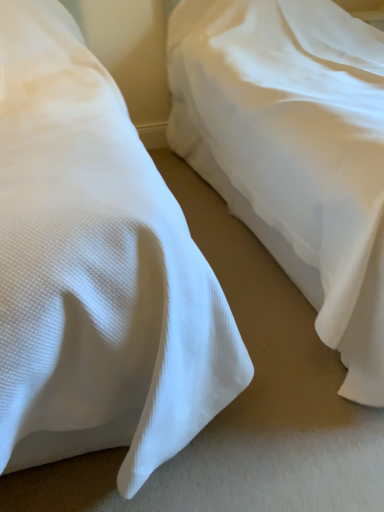
Where is `white textured pillow at left, which appears as the 1th bed when viewed from the left`? The width and height of the screenshot is (384, 512). white textured pillow at left, which appears as the 1th bed when viewed from the left is located at coordinates (96, 267).

Image resolution: width=384 pixels, height=512 pixels. Describe the element at coordinates (96, 267) in the screenshot. I see `white textured pillow at left, which appears as the 1th bed when viewed from the left` at that location.

I want to click on white textured fabric at center, placed as the 2th bed when sorted from left to right, so click(x=294, y=152).

The width and height of the screenshot is (384, 512). Describe the element at coordinates (294, 152) in the screenshot. I see `white textured fabric at center, placed as the 2th bed when sorted from left to right` at that location.

Where is `white textured pillow at left, which appears as the 1th bed when viewed from the left`? white textured pillow at left, which appears as the 1th bed when viewed from the left is located at coordinates (96, 267).

Can you confirm if white textured pillow at left, which appears as the 1th bed when viewed from the left, is positioned to the right of white textured fabric at center, the 1th bed from the right?

No, white textured pillow at left, which appears as the 1th bed when viewed from the left, is not to the right of white textured fabric at center, the 1th bed from the right.

In the scene shown: Is white textured pillow at left, the second bed viewed from the right, positioned in front of white textured fabric at center, the 1th bed from the right?

Yes, white textured pillow at left, the second bed viewed from the right, is in front of white textured fabric at center, the 1th bed from the right.

Does point (94, 449) lie behind point (356, 269)?

Yes, point (94, 449) is behind point (356, 269).

From the image's perspective, would you say white textured pillow at left, which appears as the 1th bed when viewed from the left, is shown under white textured fabric at center, placed as the 2th bed when sorted from left to right?

→ Indeed, from the image's perspective, white textured pillow at left, which appears as the 1th bed when viewed from the left, is shown beneath white textured fabric at center, placed as the 2th bed when sorted from left to right.

From a real-world perspective, is white textured pillow at left, which appears as the 1th bed when viewed from the left, on white textured fabric at center, placed as the 2th bed when sorted from left to right?

Yes, from a real-world perspective, white textured pillow at left, which appears as the 1th bed when viewed from the left, is over white textured fabric at center, placed as the 2th bed when sorted from left to right

Which object is thinner, white textured pillow at left, the second bed viewed from the right, or white textured fabric at center, placed as the 2th bed when sorted from left to right?

Thinner between the two is white textured fabric at center, placed as the 2th bed when sorted from left to right.

Which of these two, white textured pillow at left, the second bed viewed from the right, or white textured fabric at center, the 1th bed from the right, stands shorter?

white textured fabric at center, the 1th bed from the right, is shorter.

Consider the image. Which of these two, white textured pillow at left, which appears as the 1th bed when viewed from the left, or white textured fabric at center, placed as the 2th bed when sorted from left to right, is smaller?

With smaller size is white textured pillow at left, which appears as the 1th bed when viewed from the left.

Is white textured pillow at left, which appears as the 1th bed when viewed from the left, completely or partially outside of white textured fabric at center, the 1th bed from the right?

Yes, white textured pillow at left, which appears as the 1th bed when viewed from the left, is not within white textured fabric at center, the 1th bed from the right.

Would you consider white textured pillow at left, the second bed viewed from the right, to be distant from white textured fabric at center, placed as the 2th bed when sorted from left to right?

Actually, white textured pillow at left, the second bed viewed from the right, and white textured fabric at center, placed as the 2th bed when sorted from left to right, are a little close together.

Consider the image. Is white textured pillow at left, the second bed viewed from the right, positioned with its back to white textured fabric at center, the 1th bed from the right?

That's not correct — white textured pillow at left, the second bed viewed from the right, is not looking away from white textured fabric at center, the 1th bed from the right.

Consider the image. What's the angular difference between white textured pillow at left, the second bed viewed from the right, and white textured fabric at center, placed as the 2th bed when sorted from left to right,'s facing directions?

2.44e-05 degrees.

Find the location of a particular element. Image resolution: width=384 pixels, height=512 pixels. bed in front of the white textured fabric at center, the 1th bed from the right is located at coordinates (96, 267).

Considering the positions of objects white textured fabric at center, the 1th bed from the right, and white textured pillow at left, the second bed viewed from the right, in the image provided, who is more to the right, white textured fabric at center, the 1th bed from the right, or white textured pillow at left, the second bed viewed from the right,?

From the viewer's perspective, white textured fabric at center, the 1th bed from the right, appears more on the right side.

Does white textured fabric at center, the 1th bed from the right, come in front of white textured pillow at left, which appears as the 1th bed when viewed from the left?

That is False.

Which is nearer, (353, 274) or (179, 360)?

The point (179, 360) is closer to the camera.

From the image's perspective, is white textured fabric at center, the 1th bed from the right, positioned above or below white textured pillow at left, the second bed viewed from the right?

Based on their image positions, white textured fabric at center, the 1th bed from the right, is located above white textured pillow at left, the second bed viewed from the right.

From a real-world perspective, is white textured fabric at center, the 1th bed from the right, located higher than white textured pillow at left, the second bed viewed from the right?

No, from a real-world perspective, white textured fabric at center, the 1th bed from the right, is not on top of white textured pillow at left, the second bed viewed from the right.

Considering the sizes of objects white textured fabric at center, placed as the 2th bed when sorted from left to right, and white textured pillow at left, the second bed viewed from the right, in the image provided, who is thinner, white textured fabric at center, placed as the 2th bed when sorted from left to right, or white textured pillow at left, the second bed viewed from the right,?

white textured fabric at center, placed as the 2th bed when sorted from left to right.

Is white textured fabric at center, the 1th bed from the right, shorter than white textured pillow at left, the second bed viewed from the right?

Correct, white textured fabric at center, the 1th bed from the right, is not as tall as white textured pillow at left, the second bed viewed from the right.

Between white textured fabric at center, placed as the 2th bed when sorted from left to right, and white textured pillow at left, which appears as the 1th bed when viewed from the left, which one has smaller size?

white textured pillow at left, which appears as the 1th bed when viewed from the left.

In the scene shown: Is white textured fabric at center, placed as the 2th bed when sorted from left to right, inside or outside of white textured pillow at left, the second bed viewed from the right?

white textured fabric at center, placed as the 2th bed when sorted from left to right, is spatially situated outside white textured pillow at left, the second bed viewed from the right.

Are white textured fabric at center, placed as the 2th bed when sorted from left to right, and white textured pillow at left, which appears as the 1th bed when viewed from the left, far apart?

No, white textured fabric at center, placed as the 2th bed when sorted from left to right, is not far from white textured pillow at left, which appears as the 1th bed when viewed from the left.

Is white textured fabric at center, the 1th bed from the right, turned away from white textured pillow at left, which appears as the 1th bed when viewed from the left?

No, white textured fabric at center, the 1th bed from the right, is not facing the opposite direction of white textured pillow at left, which appears as the 1th bed when viewed from the left.

Can you tell me how much white textured fabric at center, placed as the 2th bed when sorted from left to right, and white textured pillow at left, which appears as the 1th bed when viewed from the left, differ in facing direction?

The angle between the facing direction of white textured fabric at center, placed as the 2th bed when sorted from left to right, and the facing direction of white textured pillow at left, which appears as the 1th bed when viewed from the left, is 2.44e-05 degrees.

This screenshot has height=512, width=384. What are the coordinates of `bed on the right side of white textured pillow at left, which appears as the 1th bed when viewed from the left` in the screenshot? It's located at (294, 152).

This screenshot has height=512, width=384. In order to click on bed above the white textured pillow at left, the second bed viewed from the right (from the image's perspective) in this screenshot , I will do `click(294, 152)`.

This screenshot has width=384, height=512. What are the coordinates of `bed in front of the white textured fabric at center, placed as the 2th bed when sorted from left to right` in the screenshot? It's located at (96, 267).